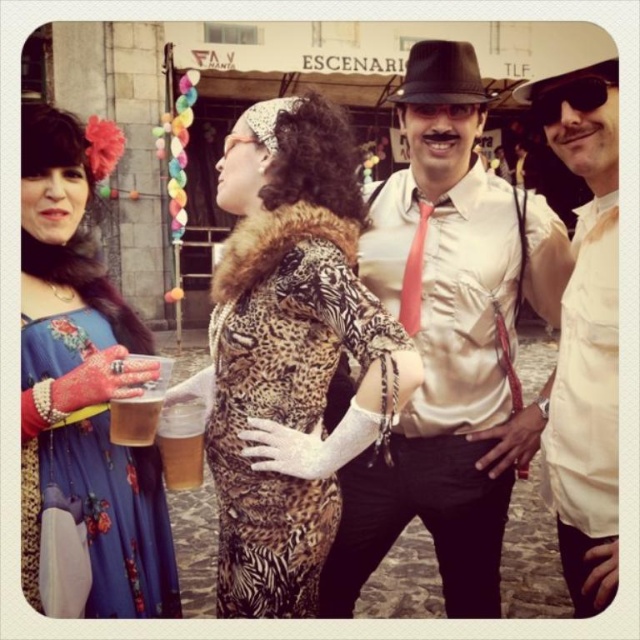
You are a photographer trying to capture a group photo of the silky white shirt at center and the white cotton shirt at center. The camera you are using has a maximum focus range of 10 feet. Will you be able to include both subjects in the frame without moving closer?

The distance between the silky white shirt at center and the white cotton shirt at center is 11.64 feet, which exceeds the camera maximum focus range of 10 feet. Therefore, you will not be able to include both subjects in the frame without moving closer.